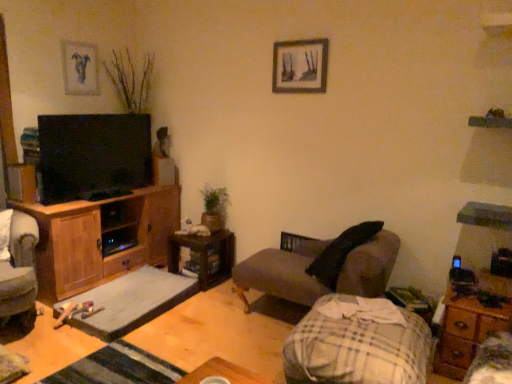
Question: Does wooden nightstand at lower right lie in front of matte blue painting at upper left, the first picture frame when ordered from back to front?

Choices:
 (A) no
 (B) yes

Answer: (B)

Question: Does wooden nightstand at lower right have a lesser width compared to matte blue painting at upper left, which is the first picture frame from left to right?

Choices:
 (A) yes
 (B) no

Answer: (B)

Question: Is wooden nightstand at lower right to the left of matte blue painting at upper left, the second picture frame viewed from the right, from the viewer's perspective?

Choices:
 (A) no
 (B) yes

Answer: (A)

Question: Considering the relative sizes of wooden nightstand at lower right and matte blue painting at upper left, the first picture frame when ordered from back to front, in the image provided, is wooden nightstand at lower right wider than matte blue painting at upper left, the first picture frame when ordered from back to front,?

Choices:
 (A) yes
 (B) no

Answer: (A)

Question: Considering the relative sizes of wooden nightstand at lower right and matte blue painting at upper left, the first picture frame when ordered from back to front, in the image provided, is wooden nightstand at lower right taller than matte blue painting at upper left, the first picture frame when ordered from back to front,?

Choices:
 (A) yes
 (B) no

Answer: (B)

Question: From a real-world perspective, is wooden nightstand at lower right located higher than matte blue painting at upper left, the second picture frame viewed from the right?

Choices:
 (A) yes
 (B) no

Answer: (B)

Question: Is the depth of wooden nightstand at lower right greater than that of wooden picture frame at upper center, which is the second picture frame in back-to-front order?

Choices:
 (A) no
 (B) yes

Answer: (A)

Question: Is wooden nightstand at lower right touching wooden picture frame at upper center, which is the 1th picture frame in front-to-back order?

Choices:
 (A) no
 (B) yes

Answer: (A)

Question: Does wooden nightstand at lower right appear on the right side of wooden picture frame at upper center, the second picture frame in the left-to-right sequence?

Choices:
 (A) yes
 (B) no

Answer: (A)

Question: Is there a large distance between wooden nightstand at lower right and wooden picture frame at upper center, which is the 1th picture frame in front-to-back order?

Choices:
 (A) no
 (B) yes

Answer: (B)

Question: Is wooden nightstand at lower right taller than wooden picture frame at upper center, which is the second picture frame in back-to-front order?

Choices:
 (A) yes
 (B) no

Answer: (A)

Question: From a real-world perspective, is wooden nightstand at lower right positioned under wooden picture frame at upper center, which is the second picture frame in back-to-front order, based on gravity?

Choices:
 (A) no
 (B) yes

Answer: (B)

Question: Can you confirm if green matte plant at center is shorter than matte blue painting at upper left, the first picture frame when ordered from back to front?

Choices:
 (A) no
 (B) yes

Answer: (B)